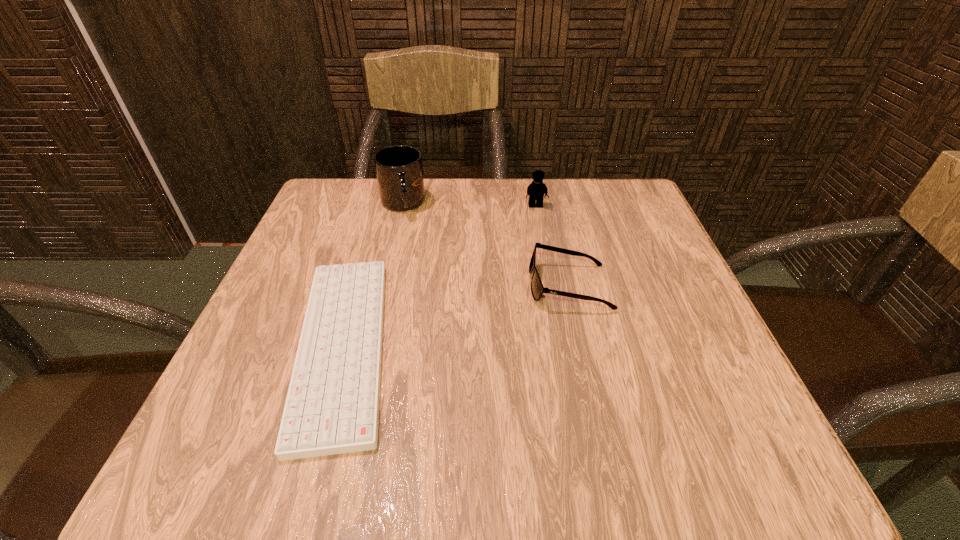
The width and height of the screenshot is (960, 540). I want to click on vacant space at the left edge of the desktop, so click(x=283, y=386).

Where is `free region at the right edge`? Image resolution: width=960 pixels, height=540 pixels. free region at the right edge is located at coordinates (666, 252).

In the image, there is a desktop. Find the location of `vacant space at the far left corner`. vacant space at the far left corner is located at coordinates (310, 209).

In order to click on free space at the far right corner of the desktop in this screenshot , I will do `click(585, 185)`.

At what (x,y) coordinates should I click in order to perform the action: click on free spot between the Lego and the sunglasses. Please return your answer as a coordinate pair (x, y). Looking at the image, I should click on (552, 246).

At what (x,y) coordinates should I click in order to perform the action: click on empty location between the shortest object and the Lego. Please return your answer as a coordinate pair (x, y). Looking at the image, I should click on (439, 276).

Locate an element on the screen. The image size is (960, 540). vacant space that's between the tallest object and the sunglasses is located at coordinates (486, 245).

The height and width of the screenshot is (540, 960). I want to click on empty location between the second shortest object and the second tallest object, so point(552,246).

At what (x,y) coordinates should I click in order to perform the action: click on unoccupied position between the third shortest object and the tallest object. Please return your answer as a coordinate pair (x, y). The height and width of the screenshot is (540, 960). Looking at the image, I should click on (469, 205).

The height and width of the screenshot is (540, 960). Find the location of `free area in between the computer keyboard and the sunglasses`. free area in between the computer keyboard and the sunglasses is located at coordinates (456, 315).